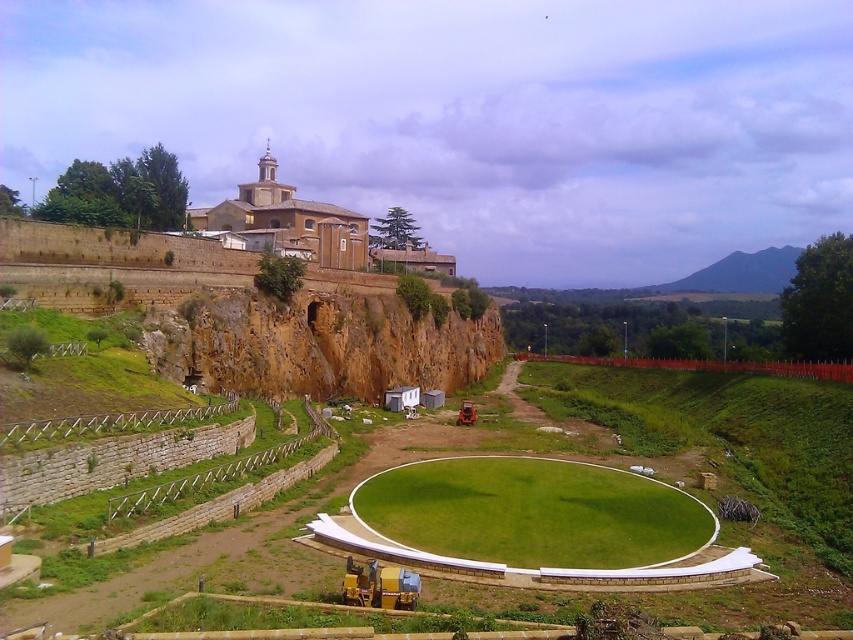
Which is behind, point (213, 288) or point (271, 228)?

The point (271, 228) is more distant.

Which is behind, point (44, 250) or point (303, 243)?

Point (303, 243)

The height and width of the screenshot is (640, 853). I want to click on brown stone cliff at upper center, so click(248, 314).